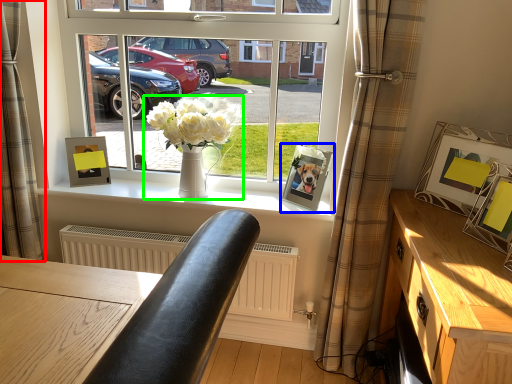
Question: Estimate the real-world distances between objects in this image. Which object is closer to curtain (highlighted by a red box), picture frame (highlighted by a blue box) or houseplant (highlighted by a green box)?

Choices:
 (A) picture frame
 (B) houseplant

Answer: (B)